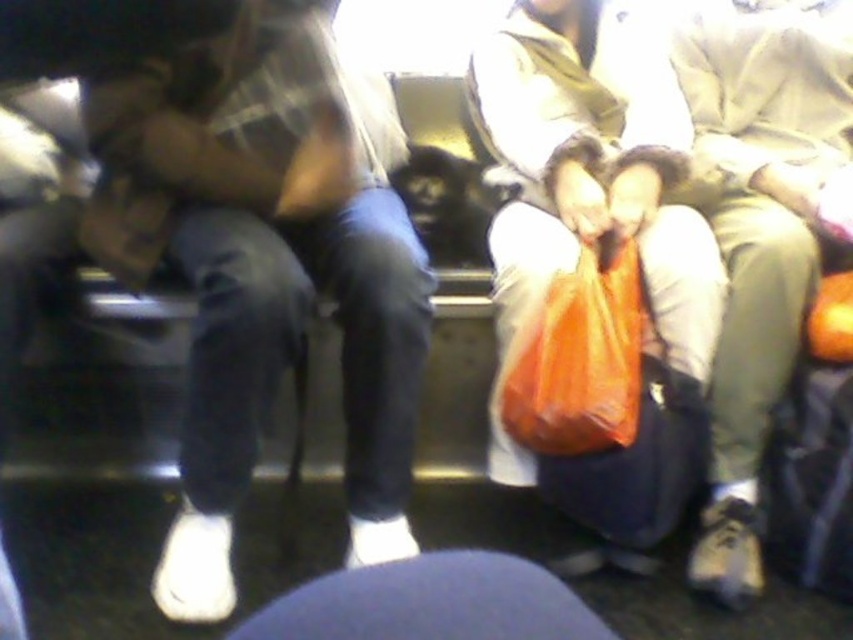
Between orange fabric bag at center and matte black suitcase at lower right, which one appears on the right side from the viewer's perspective?

matte black suitcase at lower right

Can you confirm if orange fabric bag at center is bigger than matte black suitcase at lower right?

Correct, orange fabric bag at center is larger in size than matte black suitcase at lower right.

Which is behind, point (653, 378) or point (786, 496)?

The point (786, 496) is behind.

This screenshot has width=853, height=640. I want to click on orange fabric bag at center, so click(637, 467).

From the picture: Does blue fabric at lower center have a smaller size compared to orange fabric bag at center?

Yes, blue fabric at lower center is smaller than orange fabric bag at center.

Who is positioned more to the left, blue fabric at lower center or orange fabric bag at center?

blue fabric at lower center is more to the left.

Which is in front, point (548, 624) or point (596, 513)?

Point (548, 624) is more forward.

Where is `blue fabric at lower center`? blue fabric at lower center is located at coordinates (430, 602).

Can you confirm if denim pants at left is taller than matte black suitcase at lower right?

Yes, denim pants at left is taller than matte black suitcase at lower right.

Which is below, denim pants at left or matte black suitcase at lower right?

matte black suitcase at lower right is lower down.

This screenshot has height=640, width=853. In order to click on denim pants at left in this screenshot , I will do `click(265, 268)`.

The height and width of the screenshot is (640, 853). Identify the location of denim pants at left. (265, 268).